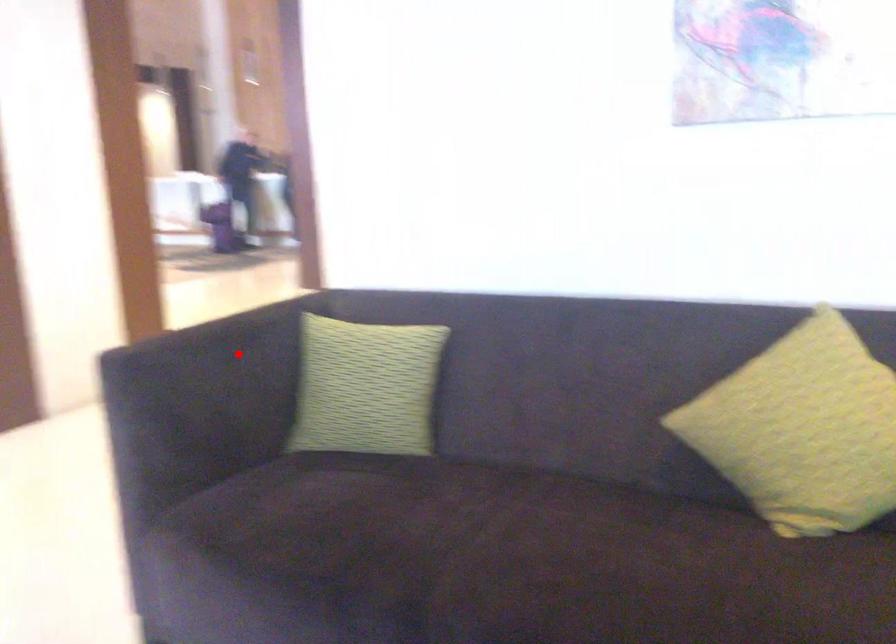
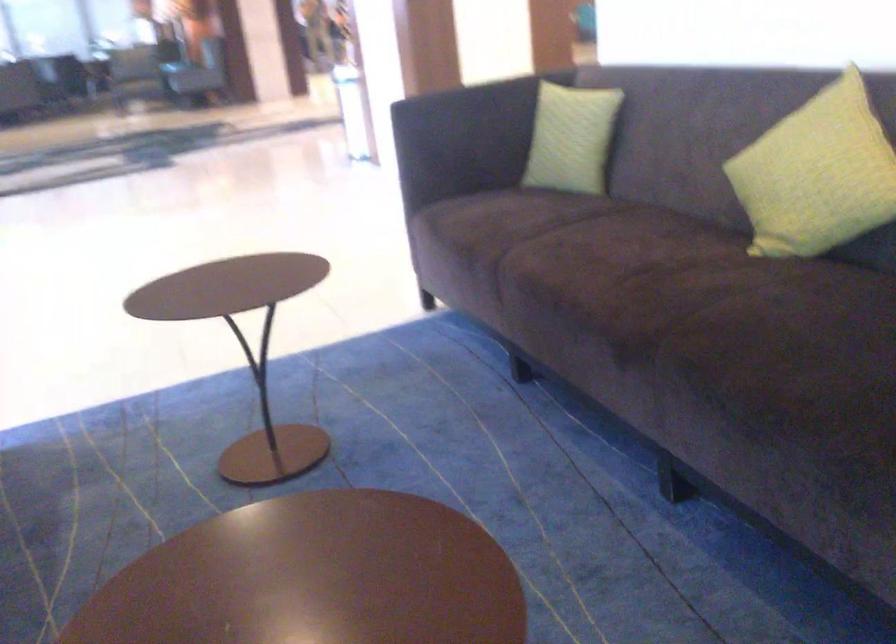
Locate, in the second image, the point that corresponds to the highlighted location in the first image.

(477, 106)